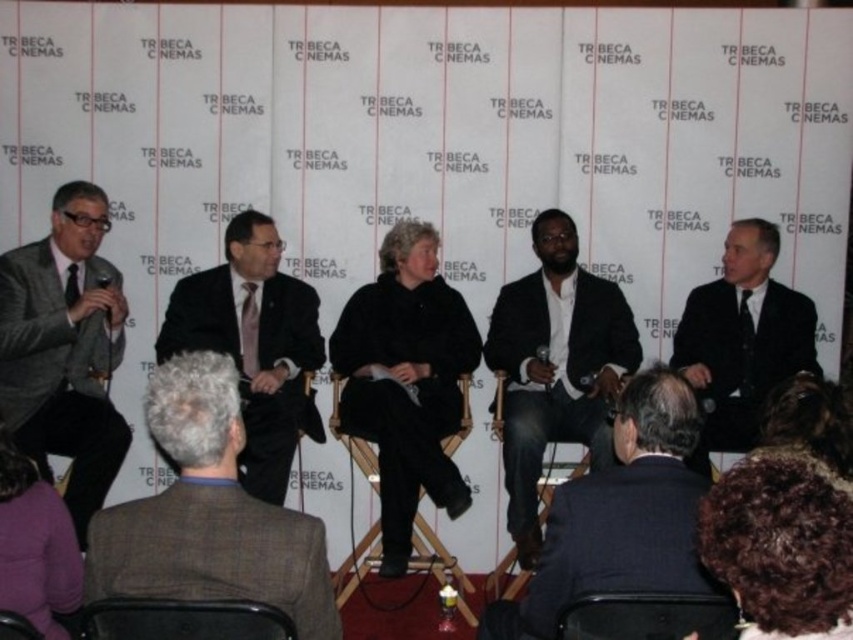
Looking at this image, you are a photographer at the Tribeca Cinemas event and need to capture a photo of the dark suit at center and the black leather chair at lower left. The camera you are using has a limited depth of field that can only focus on objects taller than 1.2 meters. Will both objects be in focus?

The dark suit at center is taller than the black leather chair at lower left. Since the camera focuses on objects taller than 1.2 meters, both objects will be in focus as the dark suit at center meets the height requirement and the black leather chair at lower left is shorter but still within the focus range.

Based on the photo, you are a photographer at the Tribeca Cinemas event. You need to capture a photo of the dark curly hair at lower right and the purple fleece jacket at lower left. Based on their heights, which one should you focus on first to ensure both are in frame?

The dark curly hair at lower right is shorter than the purple fleece jacket at lower left, so you should focus on the purple fleece jacket at lower left first to ensure both are in frame.